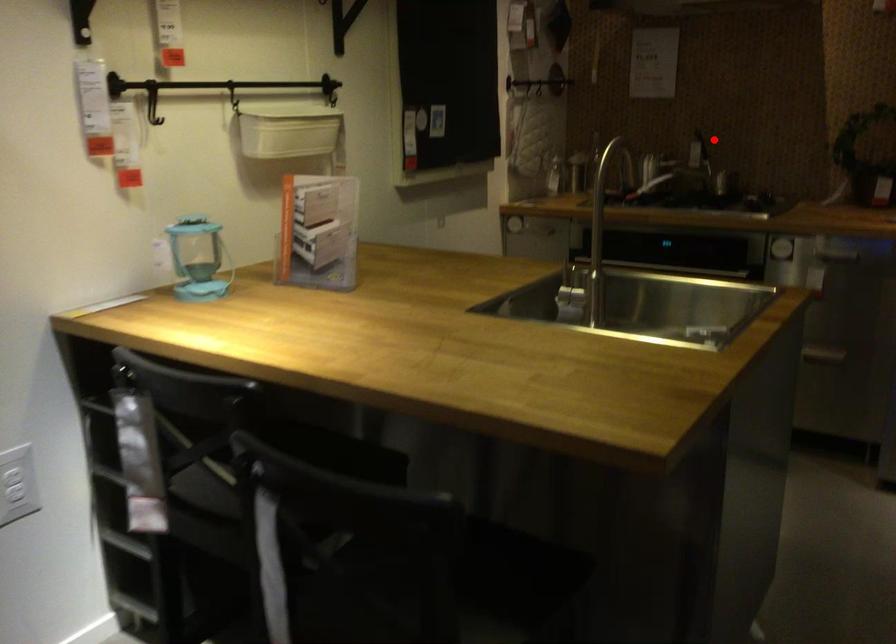
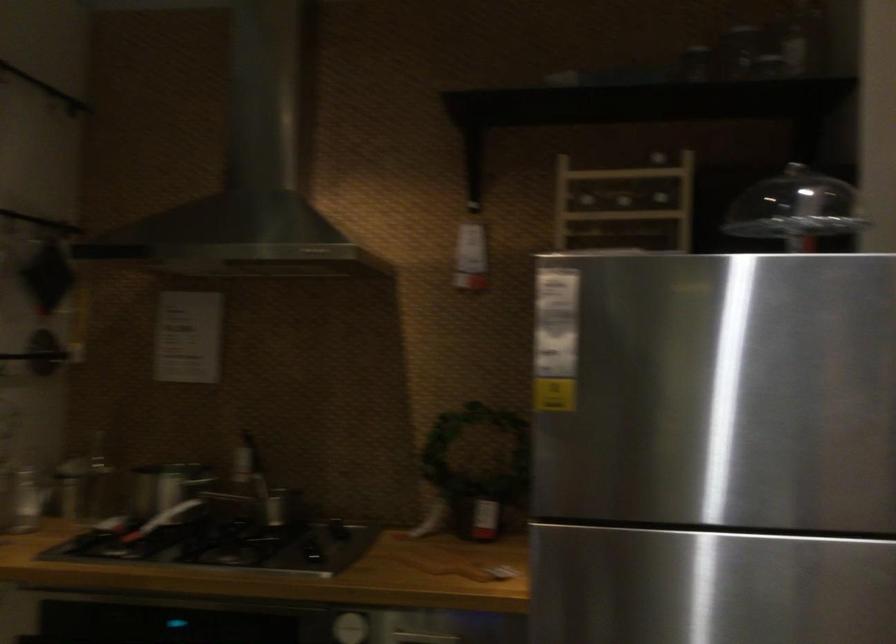
Question: I am providing you with two images of the same scene from different viewpoints. Given a red point in image1, look at the same physical point in image2. Is it:

Choices:
 (A) Closer to the viewpoint
 (B) Farther from the viewpoint

Answer: (A)